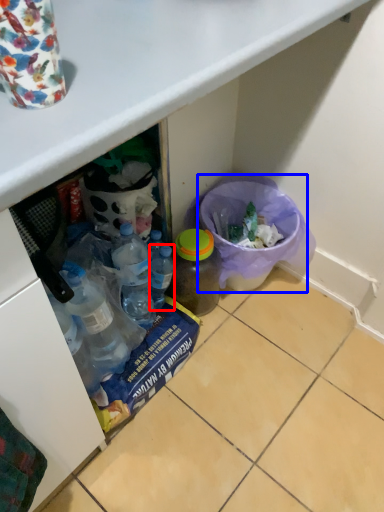
Question: Among these objects, which one is farthest to the camera, bottle (highlighted by a red box) or recycling bin (highlighted by a blue box)?

Choices:
 (A) bottle
 (B) recycling bin

Answer: (B)